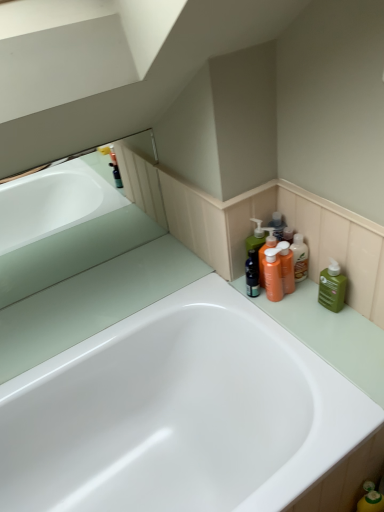
Where is `blank space to the left of translucent orange bottle at right`? This screenshot has height=512, width=384. blank space to the left of translucent orange bottle at right is located at coordinates (241, 297).